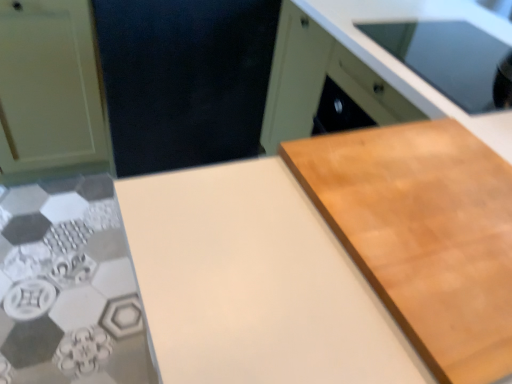
Image resolution: width=512 pixels, height=384 pixels. What do you see at coordinates (423, 234) in the screenshot?
I see `light brown wood cutting board at right` at bounding box center [423, 234].

What do you see at coordinates (50, 92) in the screenshot?
I see `matte white cabinet at left, the second cabinetry positioned from the right` at bounding box center [50, 92].

Where is `light wood cabinet at upper right, which is counted as the second cabinetry, starting from the left`? The image size is (512, 384). light wood cabinet at upper right, which is counted as the second cabinetry, starting from the left is located at coordinates [364, 63].

From a real-world perspective, is light wood cabinet at upper right, which is the 1th cabinetry in right-to-left order, beneath white matte countertop at center?

Yes, from a real-world perspective, light wood cabinet at upper right, which is the 1th cabinetry in right-to-left order, is beneath white matte countertop at center.

Does light wood cabinet at upper right, which is counted as the second cabinetry, starting from the left, have a smaller size compared to white matte countertop at center?

Actually, light wood cabinet at upper right, which is counted as the second cabinetry, starting from the left, might be larger than white matte countertop at center.

Does light wood cabinet at upper right, which is counted as the second cabinetry, starting from the left, have a greater height compared to white matte countertop at center?

Yes, light wood cabinet at upper right, which is counted as the second cabinetry, starting from the left, is taller than white matte countertop at center.

From the image's perspective, is light wood cabinet at upper right, which is the 1th cabinetry in right-to-left order, positioned above or below white matte countertop at center?

light wood cabinet at upper right, which is the 1th cabinetry in right-to-left order, is above white matte countertop at center.

How different are the orientations of light wood cabinet at upper right, which is counted as the second cabinetry, starting from the left, and light brown wood cutting board at right in degrees?

There is a 1.04-degree angle between the facing directions of light wood cabinet at upper right, which is counted as the second cabinetry, starting from the left, and light brown wood cutting board at right.

Which of these two, light wood cabinet at upper right, which is the 1th cabinetry in right-to-left order, or light brown wood cutting board at right, is bigger?

Bigger between the two is light wood cabinet at upper right, which is the 1th cabinetry in right-to-left order.

From the image's perspective, is light wood cabinet at upper right, which is counted as the second cabinetry, starting from the left, located beneath light brown wood cutting board at right?

Actually, light wood cabinet at upper right, which is counted as the second cabinetry, starting from the left, appears above light brown wood cutting board at right in the image.

Which object is closer to the camera, light wood cabinet at upper right, which is counted as the second cabinetry, starting from the left, or light brown wood cutting board at right?

light brown wood cutting board at right.

From a real-world perspective, between matte white cabinet at left, the second cabinetry positioned from the right, and light wood cabinet at upper right, which is the 1th cabinetry in right-to-left order, who is vertically lower?

matte white cabinet at left, the second cabinetry positioned from the right, is physically lower.

Which object is positioned more to the right, matte white cabinet at left, which is the first cabinetry from left to right, or light wood cabinet at upper right, which is the 1th cabinetry in right-to-left order?

From the viewer's perspective, light wood cabinet at upper right, which is the 1th cabinetry in right-to-left order, appears more on the right side.

Which object is wider, matte white cabinet at left, which is the first cabinetry from left to right, or light wood cabinet at upper right, which is counted as the second cabinetry, starting from the left?

light wood cabinet at upper right, which is counted as the second cabinetry, starting from the left, is wider.

Is white matte countertop at center not close to light brown wood cutting board at right?

No.

Considering the relative positions of white matte countertop at center and light brown wood cutting board at right in the image provided, is white matte countertop at center to the left of light brown wood cutting board at right from the viewer's perspective?

Yes.

Does white matte countertop at center turn towards light brown wood cutting board at right?

No, white matte countertop at center is not aimed at light brown wood cutting board at right.

From a real-world perspective, is white matte countertop at center positioned above or below light brown wood cutting board at right?

white matte countertop at center is situated lower than light brown wood cutting board at right in the real world.

Does matte white cabinet at left, which is the first cabinetry from left to right, appear on the left side of light brown wood cutting board at right?

Correct, you'll find matte white cabinet at left, which is the first cabinetry from left to right, to the left of light brown wood cutting board at right.

Is matte white cabinet at left, which is the first cabinetry from left to right, positioned with its back to light brown wood cutting board at right?

No.

Is white matte countertop at center surrounded by matte white cabinet at left, the second cabinetry positioned from the right?

No, matte white cabinet at left, the second cabinetry positioned from the right, does not contain white matte countertop at center.

Is matte white cabinet at left, which is the first cabinetry from left to right, at the left side of white matte countertop at center?

Yes, matte white cabinet at left, which is the first cabinetry from left to right, is to the left of white matte countertop at center.

From a real-world perspective, which is physically below, matte white cabinet at left, the second cabinetry positioned from the right, or white matte countertop at center?

matte white cabinet at left, the second cabinetry positioned from the right.

How many degrees apart are the facing directions of matte white cabinet at left, which is the first cabinetry from left to right, and white matte countertop at center?

179 degrees.

From a real-world perspective, is light wood cabinet at upper right, which is the 1th cabinetry in right-to-left order, located beneath matte white cabinet at left, the second cabinetry positioned from the right?

No, from a real-world perspective, light wood cabinet at upper right, which is the 1th cabinetry in right-to-left order, is not below matte white cabinet at left, the second cabinetry positioned from the right.

Considering their positions, is light wood cabinet at upper right, which is counted as the second cabinetry, starting from the left, located in front of or behind matte white cabinet at left, the second cabinetry positioned from the right?

Visually, light wood cabinet at upper right, which is counted as the second cabinetry, starting from the left, is located in front of matte white cabinet at left, the second cabinetry positioned from the right.

How different are the orientations of light wood cabinet at upper right, which is counted as the second cabinetry, starting from the left, and matte white cabinet at left, which is the first cabinetry from left to right, in degrees?

The angle between the facing direction of light wood cabinet at upper right, which is counted as the second cabinetry, starting from the left, and the facing direction of matte white cabinet at left, which is the first cabinetry from left to right, is 88.8 degrees.

Locate an element on the screen. The image size is (512, 384). cabinetry on the right of matte white cabinet at left, which is the first cabinetry from left to right is located at coordinates (364, 63).

Where is `counter top that appears below the light wood cabinet at upper right, which is counted as the second cabinetry, starting from the left (from the image's perspective)`? The image size is (512, 384). counter top that appears below the light wood cabinet at upper right, which is counted as the second cabinetry, starting from the left (from the image's perspective) is located at coordinates (253, 283).

You are a GUI agent. You are given a task and a screenshot of the screen. Output one action in this format:
    pyautogui.click(x=<x>, y=<y>)
    Task: Click on the cutting board in front of the light wood cabinet at upper right, which is the 1th cabinetry in right-to-left order
    
    Given the screenshot: What is the action you would take?
    pyautogui.click(x=423, y=234)

From the image, which object appears to be farther from matte white cabinet at left, the second cabinetry positioned from the right, white matte countertop at center or light wood cabinet at upper right, which is the 1th cabinetry in right-to-left order?

The object further to matte white cabinet at left, the second cabinetry positioned from the right, is white matte countertop at center.

From the image, which object appears to be farther from light wood cabinet at upper right, which is counted as the second cabinetry, starting from the left, matte white cabinet at left, which is the first cabinetry from left to right, or light brown wood cutting board at right?

matte white cabinet at left, which is the first cabinetry from left to right.

Looking at the image, which one is located closer to white matte countertop at center, light wood cabinet at upper right, which is counted as the second cabinetry, starting from the left, or light brown wood cutting board at right?

light brown wood cutting board at right.

Looking at the image, which one is located further to matte white cabinet at left, the second cabinetry positioned from the right, light brown wood cutting board at right or white matte countertop at center?

light brown wood cutting board at right lies further to matte white cabinet at left, the second cabinetry positioned from the right, than the other object.

Which object lies nearer to the anchor point light brown wood cutting board at right, matte white cabinet at left, the second cabinetry positioned from the right, or light wood cabinet at upper right, which is the 1th cabinetry in right-to-left order?

light wood cabinet at upper right, which is the 1th cabinetry in right-to-left order.

Looking at this image, from the image, which object appears to be farther from matte white cabinet at left, the second cabinetry positioned from the right, light brown wood cutting board at right or light wood cabinet at upper right, which is counted as the second cabinetry, starting from the left?

The object further to matte white cabinet at left, the second cabinetry positioned from the right, is light brown wood cutting board at right.

From the picture: Based on their spatial positions, is light wood cabinet at upper right, which is counted as the second cabinetry, starting from the left, or light brown wood cutting board at right further from matte white cabinet at left, which is the first cabinetry from left to right?

light brown wood cutting board at right lies further to matte white cabinet at left, which is the first cabinetry from left to right, than the other object.

Which object lies nearer to the anchor point light brown wood cutting board at right, light wood cabinet at upper right, which is counted as the second cabinetry, starting from the left, or white matte countertop at center?

Based on the image, white matte countertop at center appears to be nearer to light brown wood cutting board at right.

This screenshot has width=512, height=384. What are the coordinates of `cutting board positioned between white matte countertop at center and light wood cabinet at upper right, which is counted as the second cabinetry, starting from the left, from near to far` in the screenshot? It's located at (423, 234).

The width and height of the screenshot is (512, 384). Identify the location of counter top between matte white cabinet at left, which is the first cabinetry from left to right, and light brown wood cutting board at right, in the horizontal direction. (253, 283).

I want to click on counter top situated between matte white cabinet at left, which is the first cabinetry from left to right, and light wood cabinet at upper right, which is counted as the second cabinetry, starting from the left, from left to right, so click(x=253, y=283).

Image resolution: width=512 pixels, height=384 pixels. Identify the location of cutting board between matte white cabinet at left, the second cabinetry positioned from the right, and light wood cabinet at upper right, which is counted as the second cabinetry, starting from the left, in the horizontal direction. (423, 234).